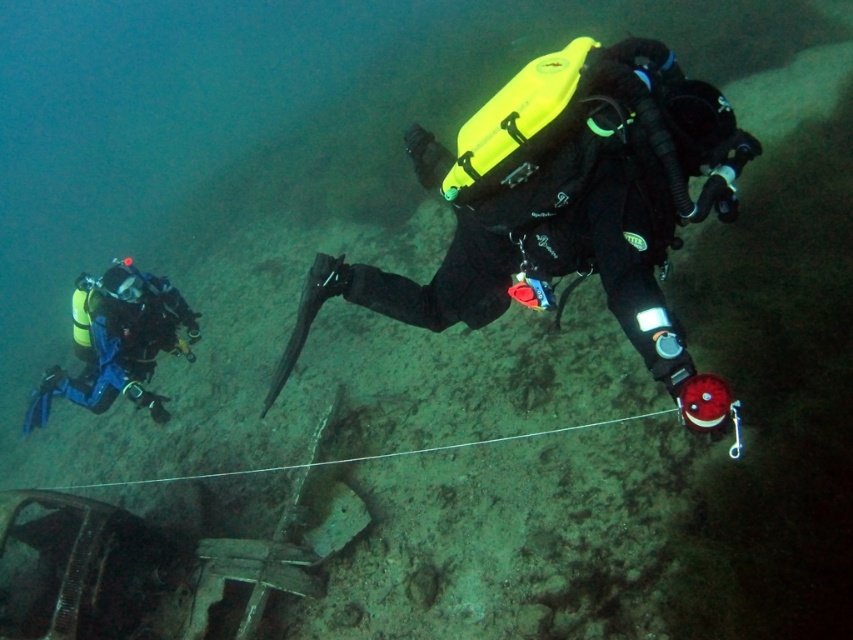
Is point (694, 422) closer to camera compared to point (125, 328)?

Yes, point (694, 422) is in front of point (125, 328).

I want to click on matte black diving suit at center, so click(567, 204).

Where is `matte black diving suit at center`? Image resolution: width=853 pixels, height=640 pixels. matte black diving suit at center is located at coordinates (567, 204).